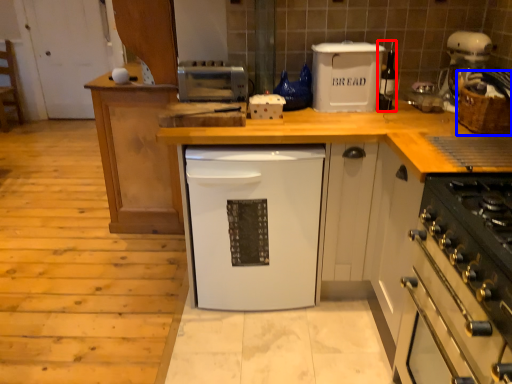
Question: Which of the following is the farthest to the observer, appliance (highlighted by a red box) or basket (highlighted by a blue box)?

Choices:
 (A) appliance
 (B) basket

Answer: (A)